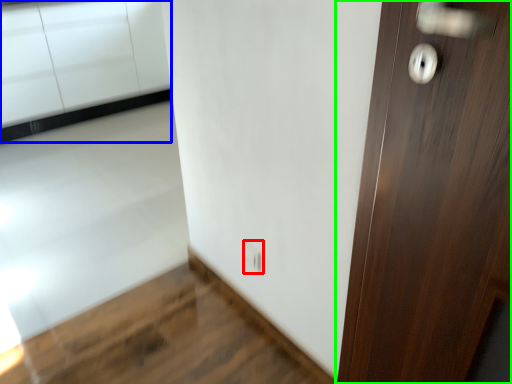
Question: Which object is the farthest from electric outlet (highlighted by a red box)? Choose among these: cabinetry (highlighted by a blue box) or door (highlighted by a green box).

Choices:
 (A) cabinetry
 (B) door

Answer: (A)